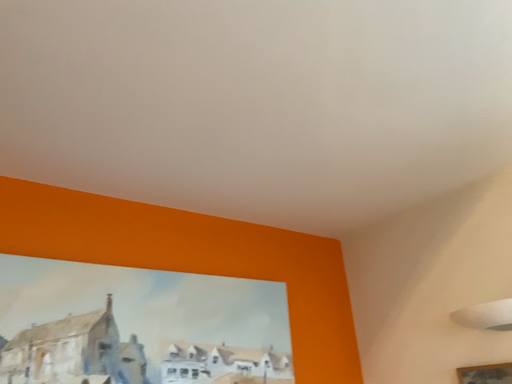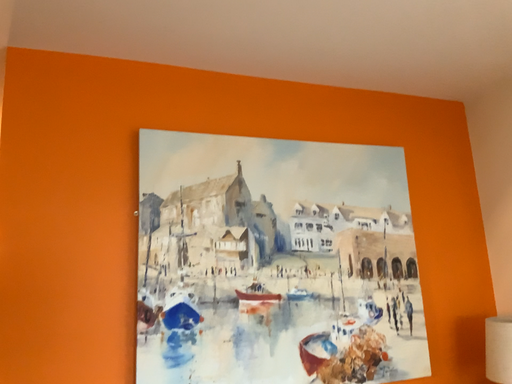
Question: Which way did the camera rotate in the video?

Choices:
 (A) rotated right
 (B) rotated left

Answer: (B)